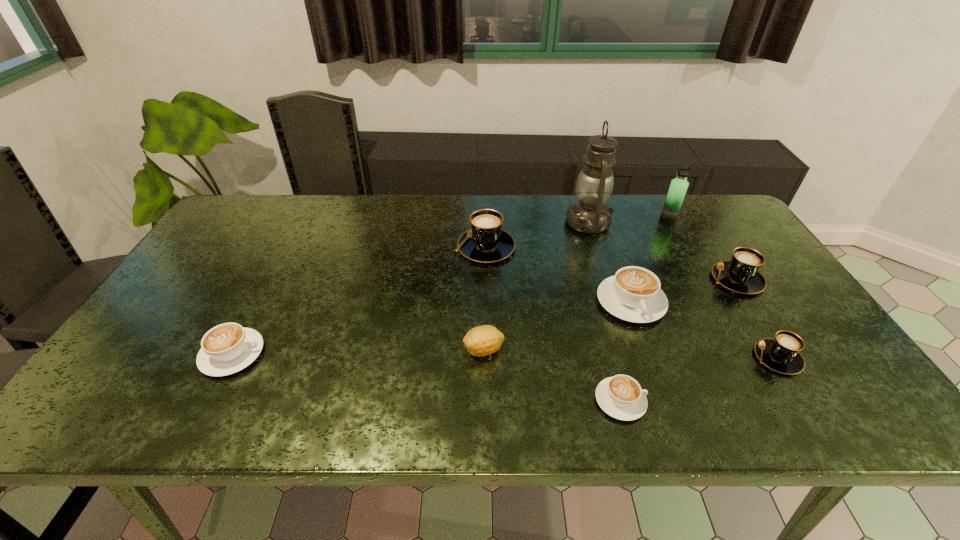
Image resolution: width=960 pixels, height=540 pixels. Find the location of `free space located 0.310m on the back of the nearest black cappuccino`. free space located 0.310m on the back of the nearest black cappuccino is located at coordinates (716, 259).

This screenshot has width=960, height=540. What are the coordinates of `vacant space located 0.290m on the side of the leftmost white cappuccino with the handle` in the screenshot? It's located at (386, 354).

Find the location of a particular element. This screenshot has height=540, width=960. free region located on the side of the smallest white cappuccino with the handle is located at coordinates (715, 400).

Image resolution: width=960 pixels, height=540 pixels. Identify the location of oil lamp located in the far edge section of the desktop. (590, 215).

Find the location of a particular element. This screenshot has width=960, height=540. thermos bottle positioned at the far edge is located at coordinates (678, 187).

In order to click on cappuccino that is at the far edge in this screenshot , I will do `click(486, 242)`.

This screenshot has height=540, width=960. I want to click on object located at the near edge, so click(x=621, y=397).

You are a GUI agent. You are given a task and a screenshot of the screen. Output one action in this format:
    pyautogui.click(x=<x>, y=<y>)
    Task: Click on the free spot at the far edge of the desktop
    This screenshot has height=540, width=960.
    Given the screenshot: What is the action you would take?
    pyautogui.click(x=555, y=196)

Locate an element on the screen. This screenshot has width=960, height=540. free space at the left edge of the desktop is located at coordinates 139,360.

Identify the location of empty space between the leftmost cappuccino and the tallest cappuccino. The image size is (960, 540). (359, 301).